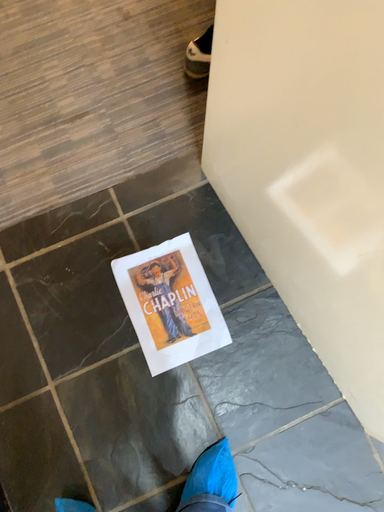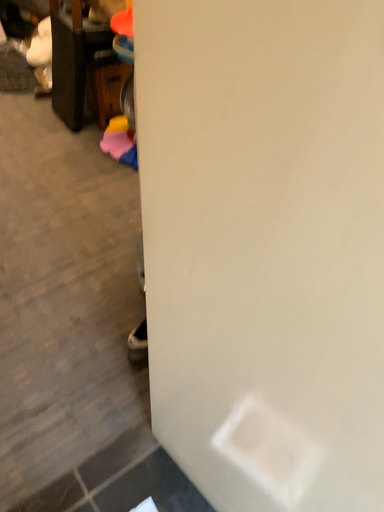
Question: How did the camera likely rotate when shooting the video?

Choices:
 (A) rotated downward
 (B) rotated upward

Answer: (B)